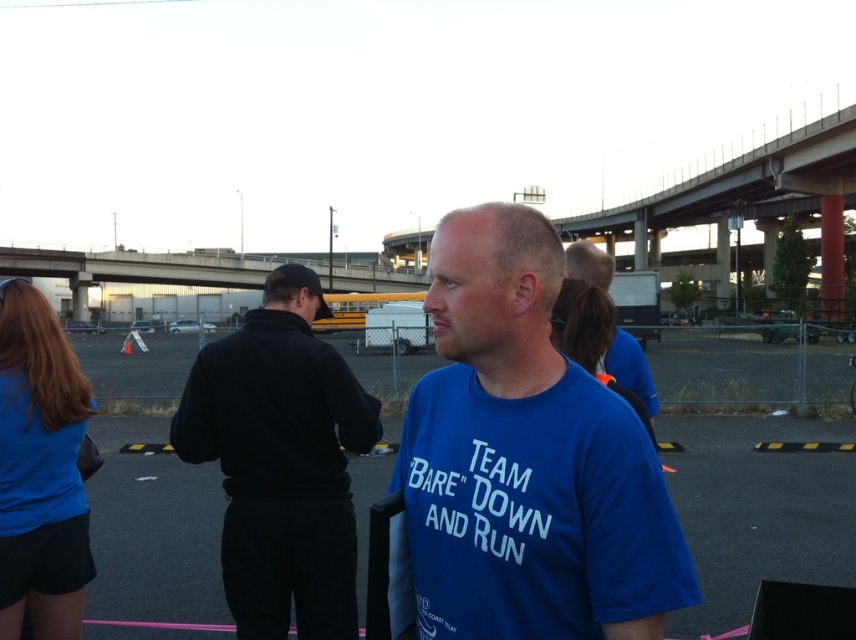
Question: Which object is the closest to the blue t-shirt at center?

Choices:
 (A) blue cotton t-shirt at center
 (B) matte blue shirt at left
 (C) black fleece jacket at center

Answer: (A)

Question: Does matte blue shirt at left have a lesser width compared to blue t-shirt at center?

Choices:
 (A) yes
 (B) no

Answer: (A)

Question: Is black fleece jacket at center wider than blue t-shirt at center?

Choices:
 (A) no
 (B) yes

Answer: (A)

Question: Among these objects, which one is farthest from the camera?

Choices:
 (A) matte blue shirt at left
 (B) blue cotton t-shirt at center
 (C) blue t-shirt at center

Answer: (A)

Question: Which point is closer to the camera taking this photo?

Choices:
 (A) (70, 445)
 (B) (446, 522)

Answer: (B)

Question: Can you confirm if blue cotton t-shirt at center is positioned above black fleece jacket at center?

Choices:
 (A) yes
 (B) no

Answer: (A)